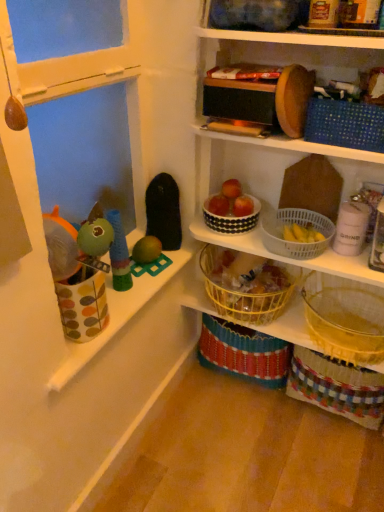
Question: Considering the relative sizes of yellow wire basket at center, the 4th basket positioned from the top, and yellow woven basket at center in the image provided, is yellow wire basket at center, the 4th basket positioned from the top, taller than yellow woven basket at center?

Choices:
 (A) no
 (B) yes

Answer: (B)

Question: Is yellow wire basket at center, the 4th basket positioned from the top, wider than yellow woven basket at center?

Choices:
 (A) no
 (B) yes

Answer: (B)

Question: Is yellow woven basket at center surrounded by yellow wire basket at center, which is counted as the second basket, starting from the bottom?

Choices:
 (A) no
 (B) yes

Answer: (A)

Question: Considering the relative sizes of yellow wire basket at center, which is counted as the second basket, starting from the bottom, and yellow woven basket at center in the image provided, is yellow wire basket at center, which is counted as the second basket, starting from the bottom, smaller than yellow woven basket at center?

Choices:
 (A) no
 (B) yes

Answer: (A)

Question: Is yellow wire basket at center, which is counted as the second basket, starting from the bottom, oriented away from yellow woven basket at center?

Choices:
 (A) no
 (B) yes

Answer: (A)

Question: Is yellow wire basket at center, which is counted as the second basket, starting from the bottom, to the right of yellow woven basket at center from the viewer's perspective?

Choices:
 (A) yes
 (B) no

Answer: (B)

Question: Is red matte apple at upper center, which is the second apple from right to left, positioned in front of green rubber toy at center, the 4th toy from the right?

Choices:
 (A) yes
 (B) no

Answer: (B)

Question: Does red matte apple at upper center, which is the second apple from right to left, have a greater width compared to green rubber toy at center, which is the 3th toy in left-to-right order?

Choices:
 (A) yes
 (B) no

Answer: (B)

Question: From a real-world perspective, is red matte apple at upper center, the second apple positioned from the left, located higher than green rubber toy at center, the 4th toy from the right?

Choices:
 (A) no
 (B) yes

Answer: (B)

Question: From the image's perspective, does red matte apple at upper center, the second apple positioned from the left, appear lower than green rubber toy at center, which is the 3th toy in left-to-right order?

Choices:
 (A) no
 (B) yes

Answer: (A)

Question: Does red matte apple at upper center, the second apple positioned from the left, have a lesser height compared to green rubber toy at center, the 4th toy from the right?

Choices:
 (A) yes
 (B) no

Answer: (B)

Question: Does red matte apple at upper center, which is the second apple from right to left, have a greater height compared to green rubber toy at center, which is the 3th toy in left-to-right order?

Choices:
 (A) yes
 (B) no

Answer: (A)

Question: Does white dotted bowl at center, placed as the second basket when sorted from top to bottom, have a greater width compared to red matte apple at upper center, the second apple positioned from the left?

Choices:
 (A) no
 (B) yes

Answer: (B)